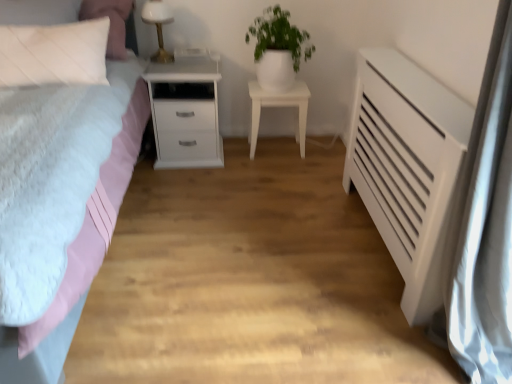
Locate an element on the screen. The width and height of the screenshot is (512, 384). free area in between white matte nightstand at left, the 2th nightstand in the right-to-left sequence, and white glossy nightstand at center, marked as the 1th nightstand in a right-to-left arrangement is located at coordinates (249, 157).